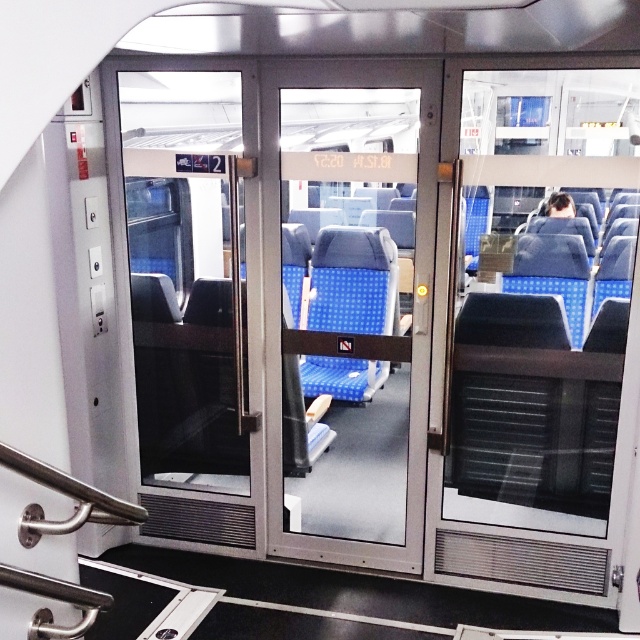
Is transparent glass door at right in front of transparent glass door at center?

Yes, it is.

Is transparent glass door at right to the right of transparent glass door at center from the viewer's perspective?

Indeed, transparent glass door at right is positioned on the right side of transparent glass door at center.

Does point (506, 252) come farther from viewer compared to point (314, 104)?

No, it is not.

This screenshot has width=640, height=640. Identify the location of transparent glass door at right. (538, 336).